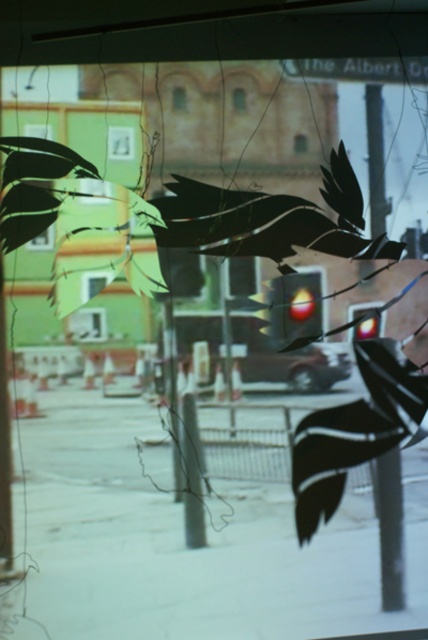
Question: Which point is farther to the camera?

Choices:
 (A) (335, 442)
 (B) (359, 198)

Answer: (B)

Question: Can you confirm if black glossy bird at center is positioned below black glossy bird at lower right?

Choices:
 (A) yes
 (B) no

Answer: (B)

Question: Can you confirm if black glossy bird at center is bigger than black glossy bird at lower right?

Choices:
 (A) no
 (B) yes

Answer: (B)

Question: Which object appears farthest from the camera in this image?

Choices:
 (A) black glossy bird at lower right
 (B) black glossy bird at center

Answer: (B)

Question: Among these objects, which one is farthest from the camera?

Choices:
 (A) black glossy bird at lower right
 (B) black glossy bird at center

Answer: (B)

Question: Does black glossy bird at center have a greater width compared to black glossy bird at lower right?

Choices:
 (A) yes
 (B) no

Answer: (A)